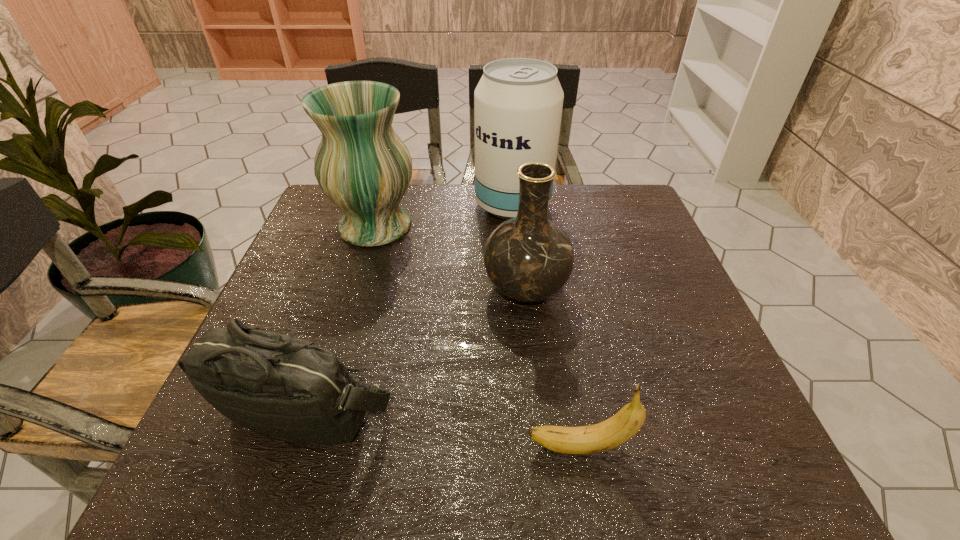
Locate an element on the screen. This screenshot has height=540, width=960. vacant space located 0.140m at the start of the peel on the shortest object is located at coordinates (444, 447).

Find the location of a particular element. The height and width of the screenshot is (540, 960). blank area located at the start of the peel on the shortest object is located at coordinates (421, 447).

In order to click on alcohol that is at the far edge in this screenshot , I will do `click(518, 102)`.

You are a GUI agent. You are given a task and a screenshot of the screen. Output one action in this format:
    pyautogui.click(x=<x>, y=<y>)
    Task: Click on the vase situated at the far edge
    The height and width of the screenshot is (540, 960).
    Given the screenshot: What is the action you would take?
    pyautogui.click(x=361, y=164)

Locate an element on the screen. The image size is (960, 540). shoulder bag located at the near edge is located at coordinates (284, 386).

Identify the location of banana that is at the near edge. (608, 434).

Locate an element on the screen. The width and height of the screenshot is (960, 540). vase that is at the left edge is located at coordinates (361, 164).

The height and width of the screenshot is (540, 960). Find the location of `shoulder bag present at the left edge`. shoulder bag present at the left edge is located at coordinates (284, 386).

Where is `object that is at the far left corner`? object that is at the far left corner is located at coordinates (x=361, y=164).

The height and width of the screenshot is (540, 960). I want to click on object that is at the near left corner, so click(x=284, y=386).